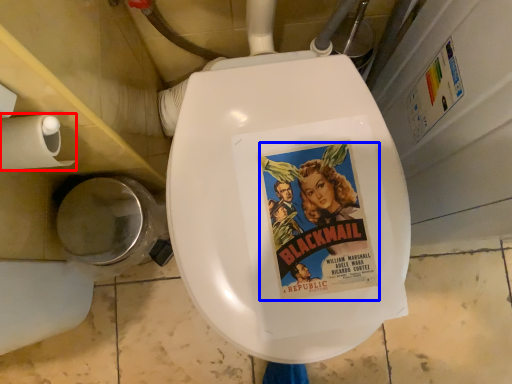
Question: Which object is further to the camera taking this photo, toilet paper (highlighted by a red box) or comic book character (highlighted by a blue box)?

Choices:
 (A) toilet paper
 (B) comic book character

Answer: (B)